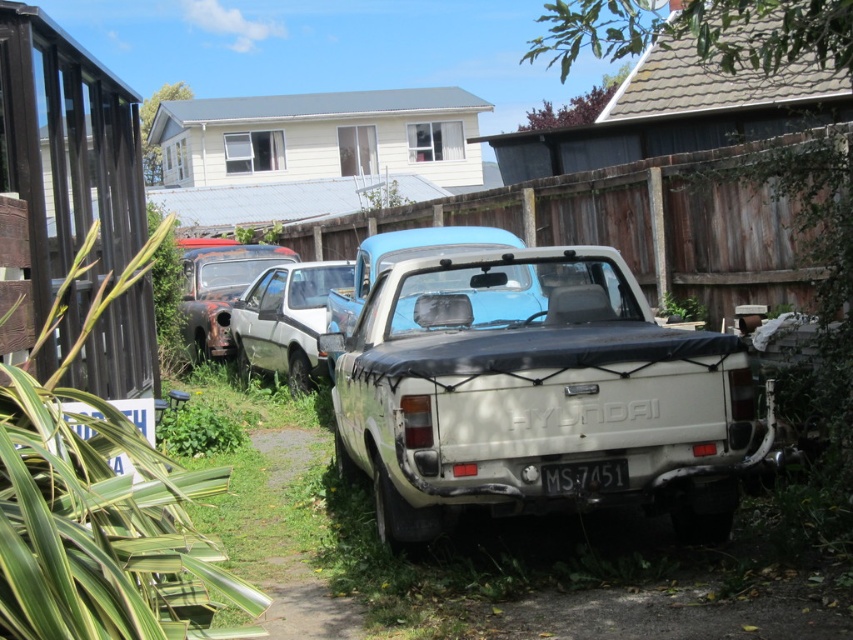
Question: Which object is positioned closest to the white matte hatchback at center?

Choices:
 (A) rusty metal car at left
 (B) white matte pickup truck at center
 (C) white plastic license plate at center
 (D) green leafy plant at left

Answer: (A)

Question: Is the position of green leafy plant at left more distant than that of rusty metal car at left?

Choices:
 (A) yes
 (B) no

Answer: (B)

Question: Does green leafy plant at left come behind white matte hatchback at center?

Choices:
 (A) no
 (B) yes

Answer: (A)

Question: Which object appears farthest from the camera in this image?

Choices:
 (A) green leafy plant at left
 (B) rusty metal car at left
 (C) white matte hatchback at center

Answer: (B)

Question: Does white matte pickup truck at center have a smaller size compared to white matte hatchback at center?

Choices:
 (A) no
 (B) yes

Answer: (A)

Question: Which point is closer to the camera?

Choices:
 (A) (285, 250)
 (B) (592, 486)

Answer: (B)